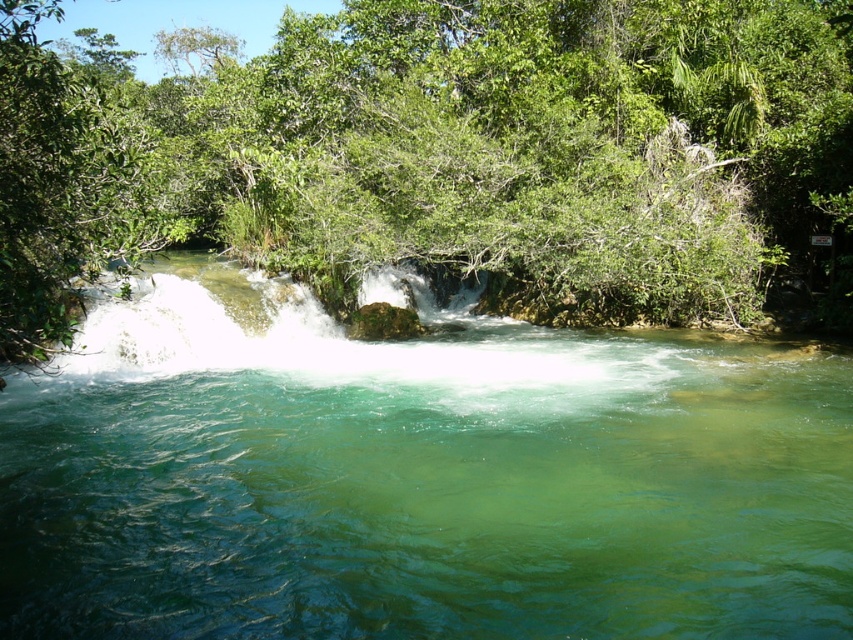
Can you confirm if clear water at center is positioned to the right of green leafy tree at upper center?

Correct, you'll find clear water at center to the right of green leafy tree at upper center.

Between point (202, 332) and point (785, 257), which one is positioned behind?

The point (785, 257) is behind.

What do you see at coordinates (416, 476) in the screenshot? The image size is (853, 640). I see `clear water at center` at bounding box center [416, 476].

Locate an element on the screen. The width and height of the screenshot is (853, 640). clear water at center is located at coordinates (416, 476).